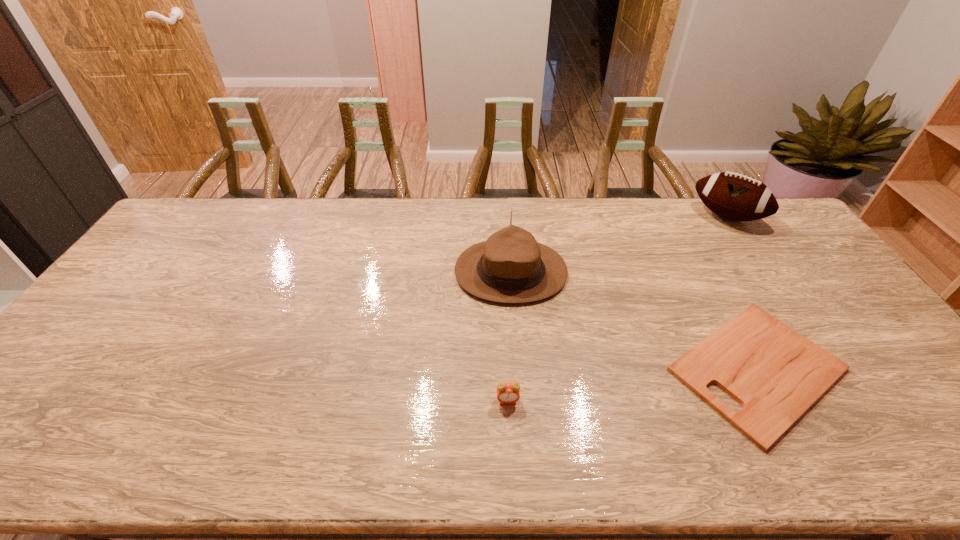
This screenshot has height=540, width=960. In order to click on object that is at the far edge in this screenshot , I will do `click(734, 196)`.

Locate an element on the screen. object positioned at the near edge is located at coordinates (776, 374).

Where is `football (American) that is positioned at the right edge`? The image size is (960, 540). football (American) that is positioned at the right edge is located at coordinates (734, 196).

Locate an element on the screen. Image resolution: width=960 pixels, height=540 pixels. chopping board that is at the right edge is located at coordinates (776, 374).

The image size is (960, 540). Find the location of `object located in the far right corner section of the desktop`. object located in the far right corner section of the desktop is located at coordinates (734, 196).

Where is `object that is at the near right corner`? object that is at the near right corner is located at coordinates (776, 374).

You are a GUI agent. You are given a task and a screenshot of the screen. Output one action in this format:
    pyautogui.click(x=<x>, y=<y>)
    Task: Click on the vacant region at the far edge of the desktop
    
    Given the screenshot: What is the action you would take?
    pyautogui.click(x=406, y=198)

In the image, there is a desktop. What are the coordinates of `blank space at the near edge` in the screenshot? It's located at (409, 467).

The image size is (960, 540). Find the location of `free spot at the left edge of the desktop`. free spot at the left edge of the desktop is located at coordinates (107, 315).

Identify the location of free space at the far left corner of the desktop. Image resolution: width=960 pixels, height=540 pixels. (167, 229).